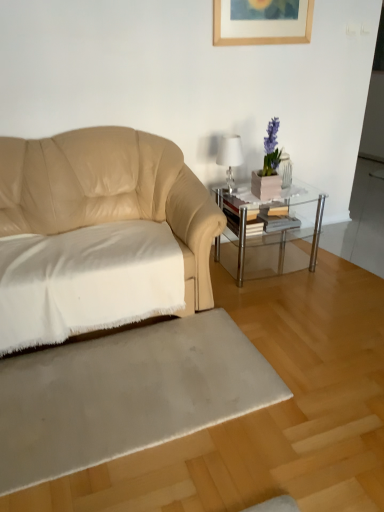
Question: Can you confirm if silky beige rug at lower center is wider than white soft fabric at left?

Choices:
 (A) yes
 (B) no

Answer: (A)

Question: From a real-world perspective, is silky beige rug at lower center located beneath white soft fabric at left?

Choices:
 (A) no
 (B) yes

Answer: (B)

Question: Does silky beige rug at lower center appear on the left side of white soft fabric at left?

Choices:
 (A) yes
 (B) no

Answer: (B)

Question: Considering the relative sizes of silky beige rug at lower center and white soft fabric at left in the image provided, is silky beige rug at lower center taller than white soft fabric at left?

Choices:
 (A) yes
 (B) no

Answer: (B)

Question: From a real-world perspective, is silky beige rug at lower center on top of white soft fabric at left?

Choices:
 (A) no
 (B) yes

Answer: (A)

Question: Is silky beige rug at lower center wider or thinner than white glossy table lamp at upper right?

Choices:
 (A) thin
 (B) wide

Answer: (B)

Question: Would you say silky beige rug at lower center is to the left or to the right of white glossy table lamp at upper right in the picture?

Choices:
 (A) right
 (B) left

Answer: (B)

Question: In terms of size, does silky beige rug at lower center appear bigger or smaller than white glossy table lamp at upper right?

Choices:
 (A) small
 (B) big

Answer: (B)

Question: Relative to white glossy table lamp at upper right, is silky beige rug at lower center in front or behind?

Choices:
 (A) front
 (B) behind

Answer: (A)

Question: From the image's perspective, is white glossy table lamp at upper right above or below clear glass table at center?

Choices:
 (A) above
 (B) below

Answer: (A)

Question: Would you say white glossy table lamp at upper right is inside or outside clear glass table at center?

Choices:
 (A) outside
 (B) inside

Answer: (A)

Question: Is white glossy table lamp at upper right to the left or to the right of clear glass table at center in the image?

Choices:
 (A) left
 (B) right

Answer: (A)

Question: Is white glossy table lamp at upper right taller or shorter than clear glass table at center?

Choices:
 (A) tall
 (B) short

Answer: (B)

Question: From a real-world perspective, is clear glass table at center above or below white glossy table lamp at upper right?

Choices:
 (A) below
 (B) above

Answer: (A)

Question: In terms of width, does clear glass table at center look wider or thinner when compared to white glossy table lamp at upper right?

Choices:
 (A) wide
 (B) thin

Answer: (A)